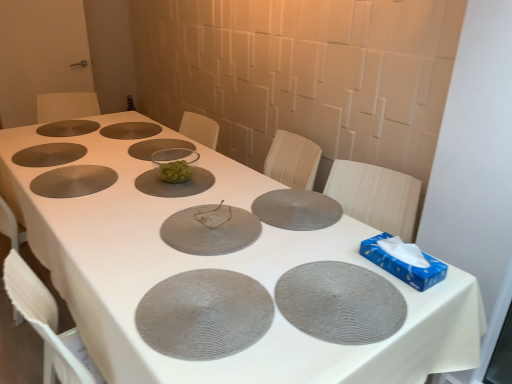
This screenshot has height=384, width=512. Find the location of `space that is in front of matte gray placemat at left, which appears as the sixth glass plate when viewed from the back`. space that is in front of matte gray placemat at left, which appears as the sixth glass plate when viewed from the back is located at coordinates (72, 205).